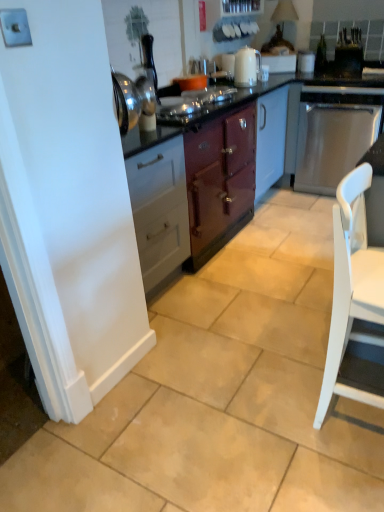
Question: From their relative heights in the image, would you say stainless steel dishwasher at right, the first kitchen appliance from the right, is taller or shorter than satin black toaster at upper right, which is the 1th appliance in right-to-left order?

Choices:
 (A) short
 (B) tall

Answer: (B)

Question: Choose the correct answer: Is stainless steel dishwasher at right, the first kitchen appliance from the right, inside satin black toaster at upper right, which is the 1th appliance in right-to-left order, or outside it?

Choices:
 (A) outside
 (B) inside

Answer: (A)

Question: Based on their relative distances, which object is nearer to the satin black toaster at upper right, which appears as the second appliance when viewed from the left?

Choices:
 (A) white glossy cup at upper center, marked as the first appliance in a left-to-right arrangement
 (B) stainless steel dishwasher at right, the first kitchen appliance from the right
 (C) white matte chair at lower right
 (D) white glossy electric kettle at upper center, the first kitchen appliance when ordered from left to right

Answer: (A)

Question: Which of these objects is positioned closest to the white glossy cup at upper center, marked as the first appliance in a left-to-right arrangement?

Choices:
 (A) white matte chair at lower right
 (B) white glossy electric kettle at upper center, which ranks as the 2th kitchen appliance in right-to-left order
 (C) satin black toaster at upper right, which is the 1th appliance in right-to-left order
 (D) stainless steel dishwasher at right, the 2th kitchen appliance viewed from the left

Answer: (C)